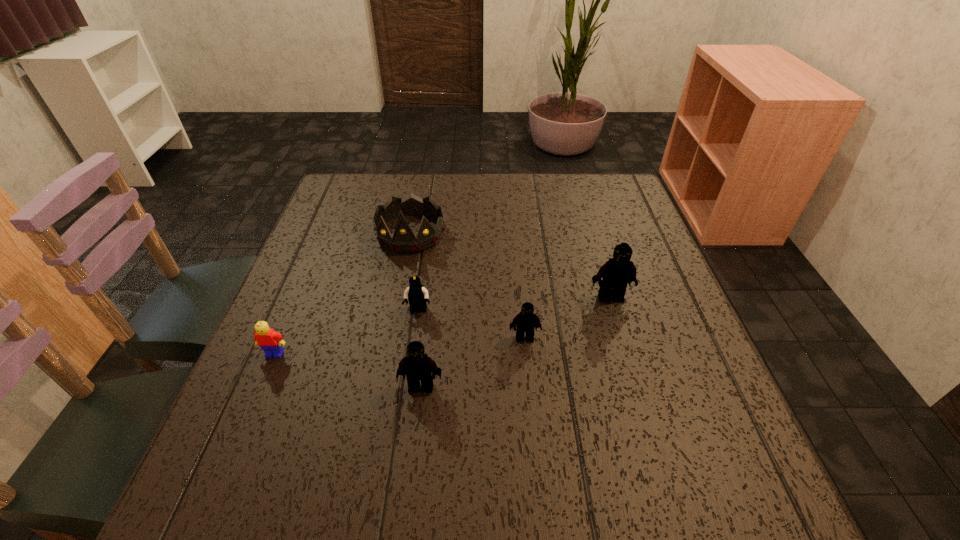
Find the location of a particular element. The height and width of the screenshot is (540, 960). vacant area located on the face of the second object from right to left is located at coordinates (530, 394).

The height and width of the screenshot is (540, 960). I want to click on vacant region located 0.050m on the face of the tallest Lego, so click(617, 320).

Locate an element on the screen. Image resolution: width=960 pixels, height=540 pixels. free space located 0.340m at the front of the farthest object with jewels is located at coordinates (385, 369).

I want to click on free point located on the front-facing side of the leftmost object, so click(x=239, y=440).

Where is `free space located on the front-facing side of the fourth nearest Lego`? The image size is (960, 540). free space located on the front-facing side of the fourth nearest Lego is located at coordinates (410, 370).

This screenshot has width=960, height=540. I want to click on object that is at the far edge, so click(403, 241).

The width and height of the screenshot is (960, 540). Find the location of `object present at the left edge`. object present at the left edge is located at coordinates (270, 341).

Image resolution: width=960 pixels, height=540 pixels. I want to click on object present at the right edge, so click(x=619, y=271).

Locate an element on the screen. The width and height of the screenshot is (960, 540). free space at the far edge of the desktop is located at coordinates (570, 183).

At what (x,y) coordinates should I click in order to perform the action: click on free space at the near edge of the desktop. Please return your answer as a coordinate pair (x, y). Looking at the image, I should click on (395, 435).